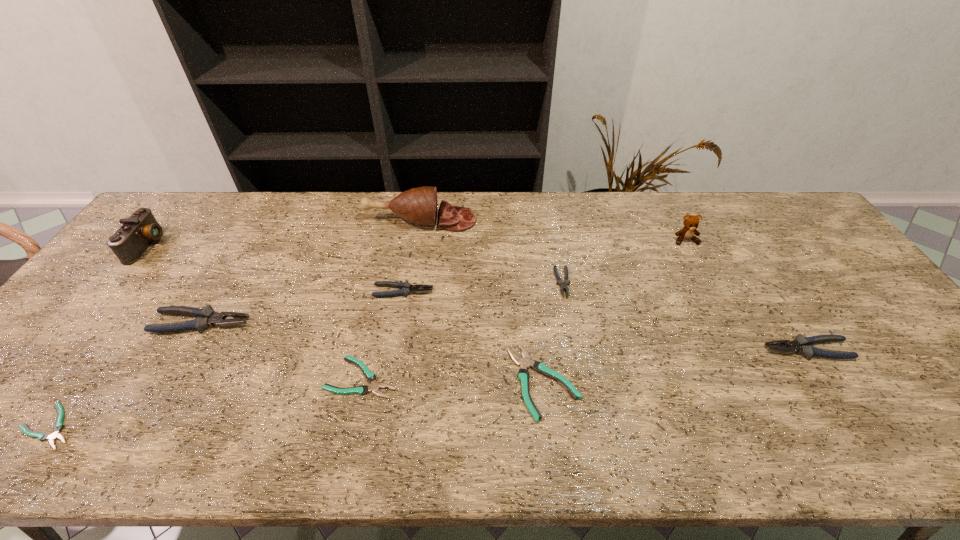
You are a GUI agent. You are given a task and a screenshot of the screen. Output one action in this format:
    pyautogui.click(x=<x>, y=<y>)
    Task: Click on the free space that satisfies the following two spatial constraints: 1. on the lens of the second shortest object; 2. on the right side of the camera
    This screenshot has height=540, width=960.
    Given the screenshot: What is the action you would take?
    pyautogui.click(x=40, y=377)